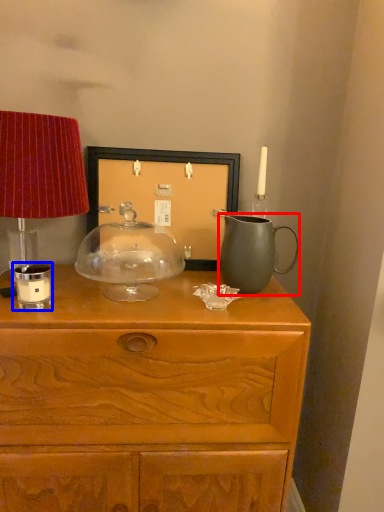
Question: Which point is further to the camera, jug (highlighted by a red box) or candle holder (highlighted by a blue box)?

Choices:
 (A) jug
 (B) candle holder

Answer: (A)